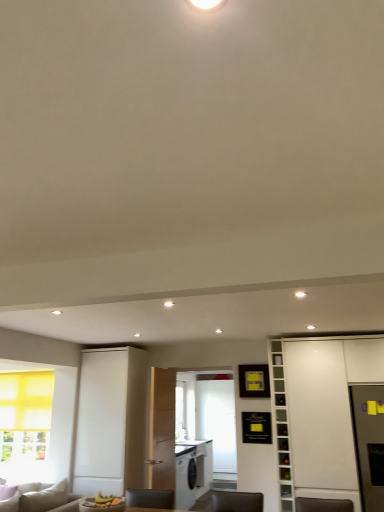
Question: From the image's perspective, relative to white matte cabinet at right, is white glossy bookshelf at right above or below?

Choices:
 (A) below
 (B) above

Answer: (A)

Question: Is white glossy bookshelf at right wider or thinner than white matte cabinet at right?

Choices:
 (A) wide
 (B) thin

Answer: (B)

Question: In the image, is white glossy bookshelf at right positioned in front of or behind white matte cabinet at right?

Choices:
 (A) behind
 (B) front

Answer: (A)

Question: Considering the relative positions of white matte cabinet at right and white glossy bookshelf at right in the image provided, is white matte cabinet at right to the left or to the right of white glossy bookshelf at right?

Choices:
 (A) left
 (B) right

Answer: (B)

Question: Looking at their shapes, would you say white matte cabinet at right is wider or thinner than white glossy bookshelf at right?

Choices:
 (A) thin
 (B) wide

Answer: (B)

Question: Considering their positions, is white matte cabinet at right located in front of or behind white glossy bookshelf at right?

Choices:
 (A) behind
 (B) front

Answer: (B)

Question: From a real-world perspective, is white matte cabinet at right above or below white glossy bookshelf at right?

Choices:
 (A) above
 (B) below

Answer: (B)